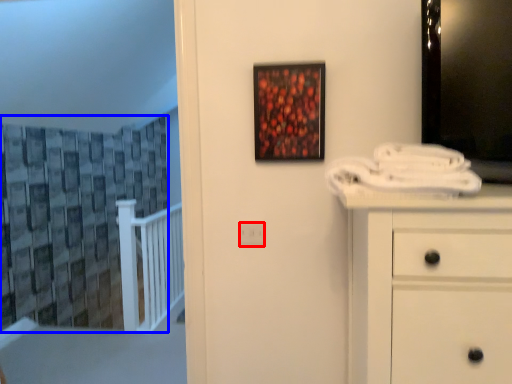
Question: Which object is closer to the camera taking this photo, electric outlet (highlighted by a red box) or curtain (highlighted by a blue box)?

Choices:
 (A) electric outlet
 (B) curtain

Answer: (B)